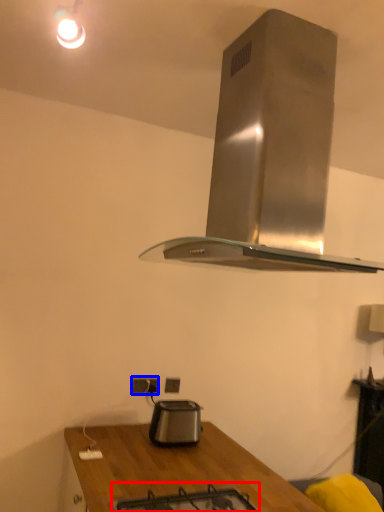
Question: Which of the following is the farthest to the observer, gas stove (highlighted by a red box) or electric outlet (highlighted by a blue box)?

Choices:
 (A) gas stove
 (B) electric outlet

Answer: (B)